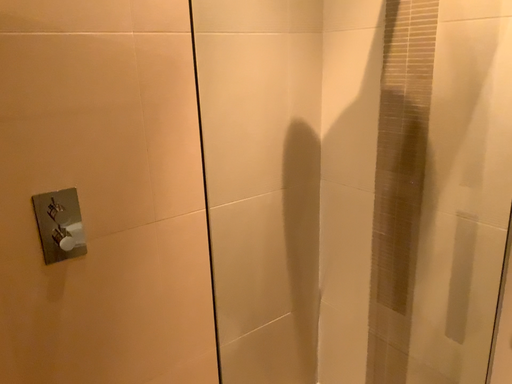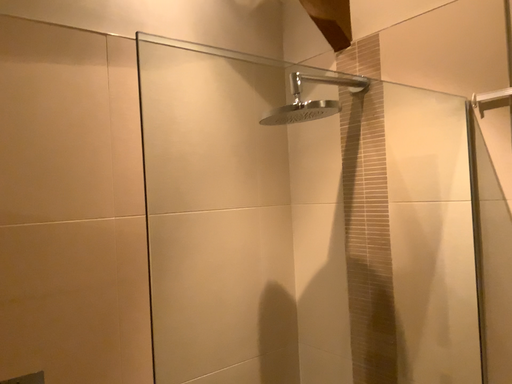
Question: Which way did the camera rotate in the video?

Choices:
 (A) rotated upward
 (B) rotated downward

Answer: (A)